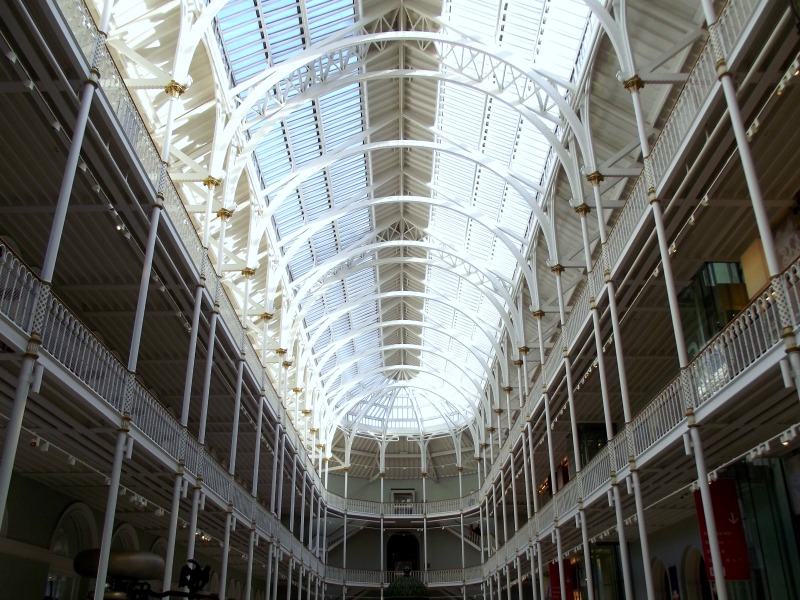
Locate an element on the screen. This screenshot has height=600, width=800. ceiling is located at coordinates (409, 148).